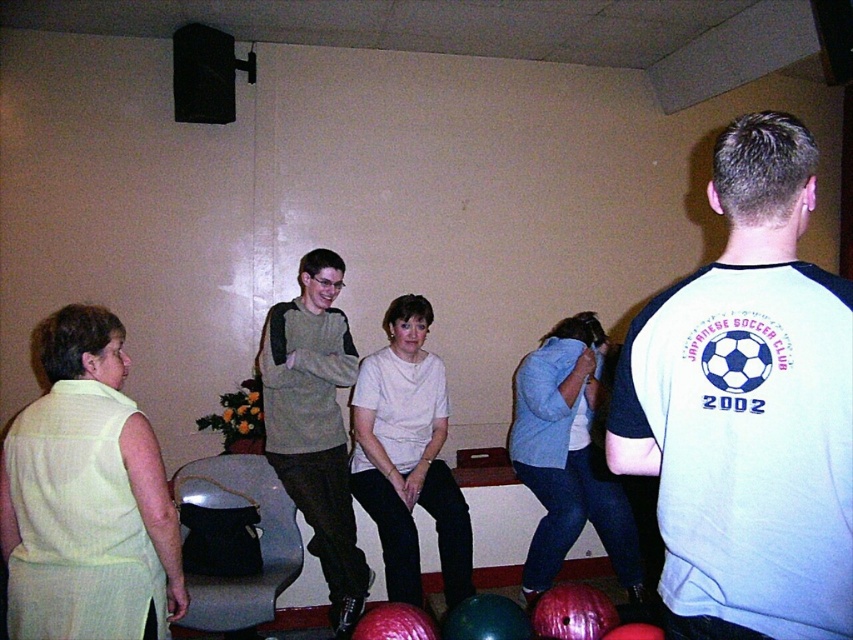
Question: Can you confirm if white jersey at center is positioned to the right of light gray sweater at center?

Choices:
 (A) yes
 (B) no

Answer: (A)

Question: Which point is closer to the camera taking this photo?

Choices:
 (A) tap(283, 346)
 (B) tap(701, 298)

Answer: (B)

Question: Observing the image, what is the correct spatial positioning of white jersey at center in reference to light gray sweater at center?

Choices:
 (A) above
 (B) below

Answer: (A)

Question: Which object appears closest to the camera in this image?

Choices:
 (A) light gray sweater at center
 (B) white jersey at center

Answer: (B)

Question: Which point is closer to the camera taking this photo?

Choices:
 (A) (352, 548)
 (B) (749, 317)

Answer: (B)

Question: Does white jersey at center lie in front of light gray sweater at center?

Choices:
 (A) no
 (B) yes

Answer: (B)